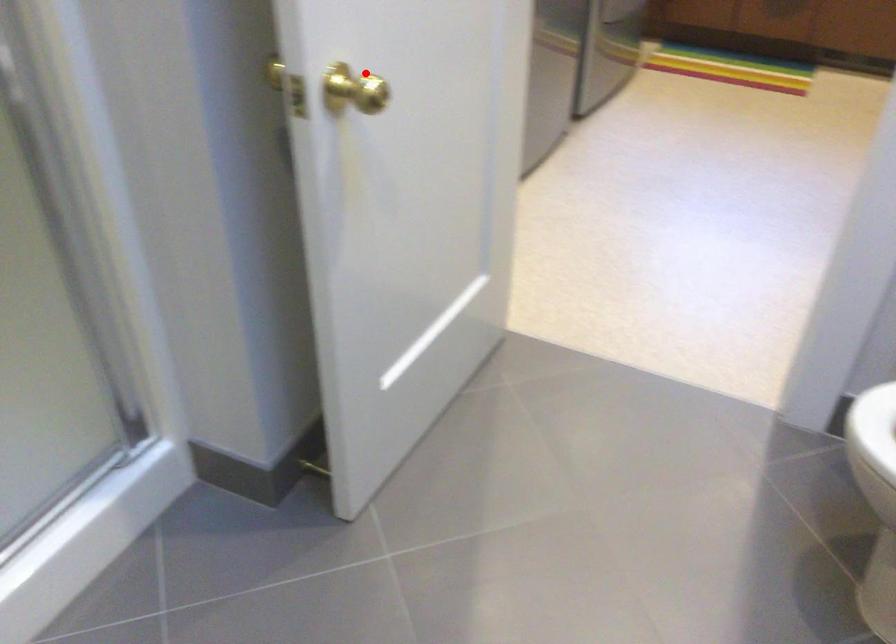
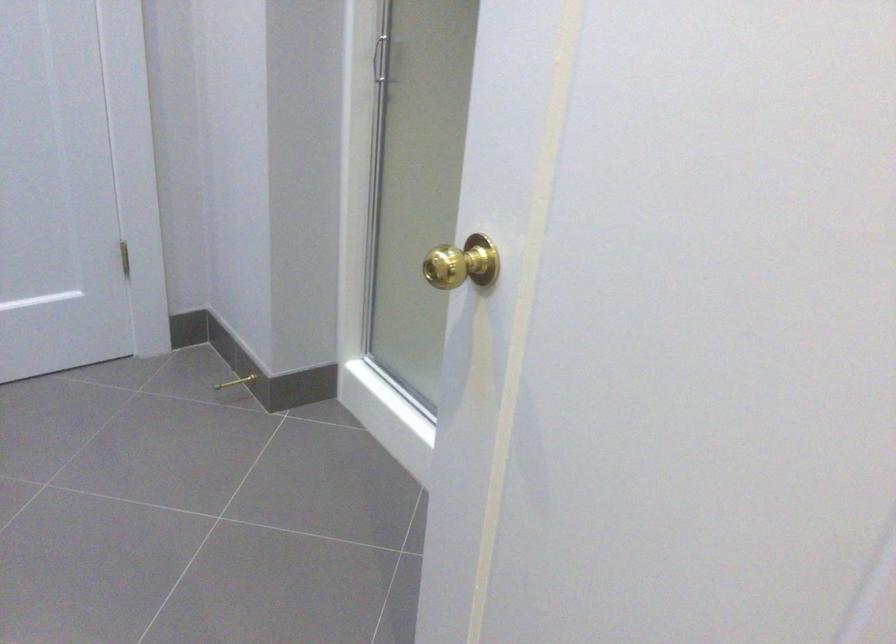
Where in the second image is the point corresponding to the highlighted location from the first image?

(461, 263)